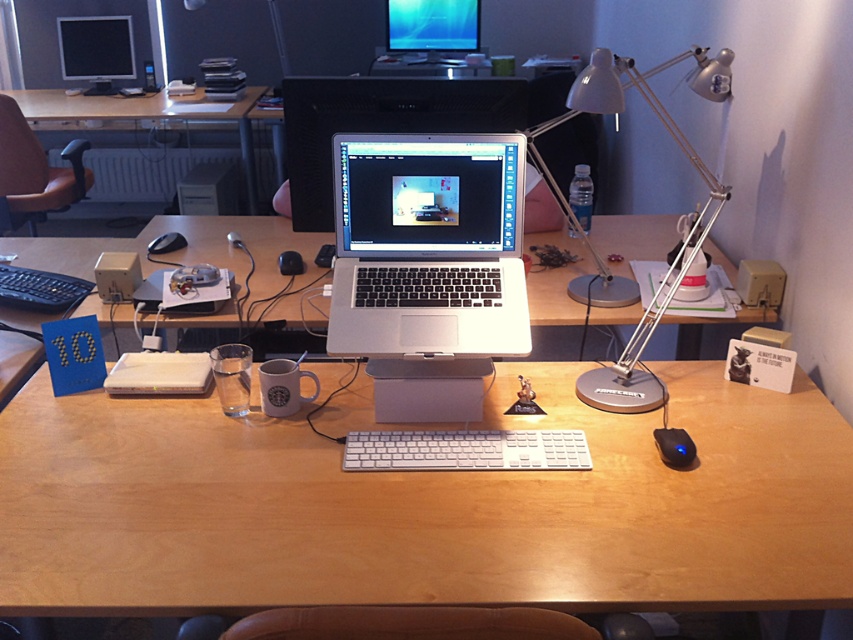
Question: Which object is closer to the camera taking this photo?

Choices:
 (A) wooden desk at center
 (B) metallic silver desk lamp at right

Answer: (A)

Question: Can you confirm if metallic silver desk lamp at right is positioned below wooden table at upper left?

Choices:
 (A) yes
 (B) no

Answer: (A)

Question: Estimate the real-world distances between objects in this image. Which object is farther from the metallic silver desk lamp at right?

Choices:
 (A) silver metallic laptop at center
 (B) matte black monitor at upper center
 (C) brown leather chair at left
 (D) white plastic keyboard at center

Answer: (C)

Question: Can you confirm if wooden desk at center is thinner than metallic silver desk lamp at right?

Choices:
 (A) no
 (B) yes

Answer: (A)

Question: Which point is closer to the camera taking this photo?

Choices:
 (A) (579, 458)
 (B) (113, 76)
 (C) (26, 152)

Answer: (A)

Question: Is wooden desk at center below metallic silver desk lamp at right?

Choices:
 (A) yes
 (B) no

Answer: (A)